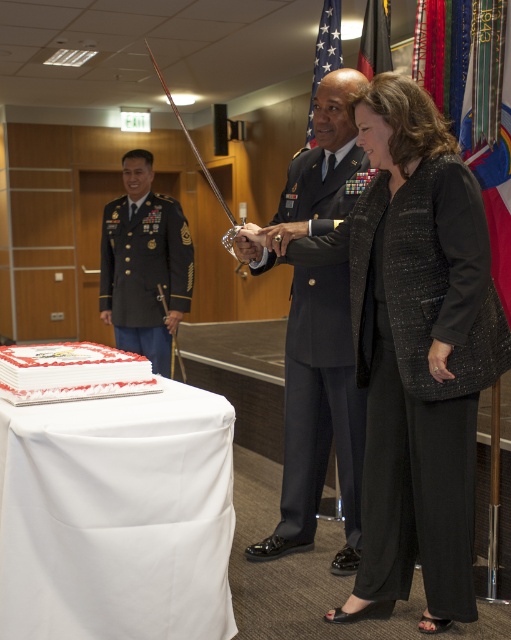
Which is more to the right, black textured pants at lower right or green military uniform at left?

black textured pants at lower right is more to the right.

Is black textured pants at lower right in front of green military uniform at left?

That is True.

Does point (463, 378) lie in front of point (159, 227)?

Yes, point (463, 378) is closer to viewer.

What are the coordinates of `black textured pants at lower right` in the screenshot? It's located at (423, 378).

Based on the photo, can you confirm if navy blue fabric uniform at center is bigger than green military uniform at left?

Yes.

Does point (322, 291) come closer to viewer compared to point (154, 291)?

Yes, it is in front of point (154, 291).

Where is `navy blue fabric uniform at center`? The image size is (511, 640). navy blue fabric uniform at center is located at coordinates (320, 403).

Based on the photo, between white frosted cake at lower left and american flag at upper center, which one is positioned higher?

american flag at upper center is higher up.

Between point (34, 364) and point (313, 140), which one is positioned in front?

Point (34, 364)

At what (x,y) coordinates should I click in order to perform the action: click on white frosted cake at lower left. Please return your answer as a coordinate pair (x, y). Looking at the image, I should click on click(72, 372).